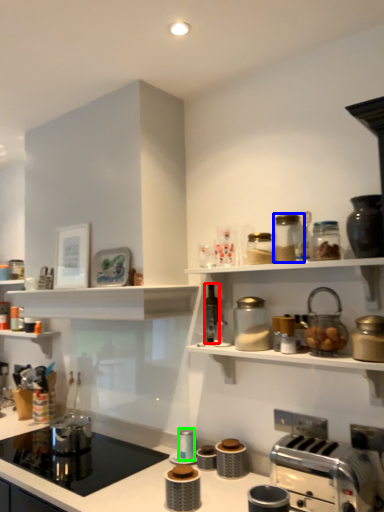
Question: Based on their relative distances, which object is nearer to bottle (highlighted by a red box)? Choose from glass jar (highlighted by a blue box) and appliance (highlighted by a green box).

Choices:
 (A) glass jar
 (B) appliance

Answer: (A)